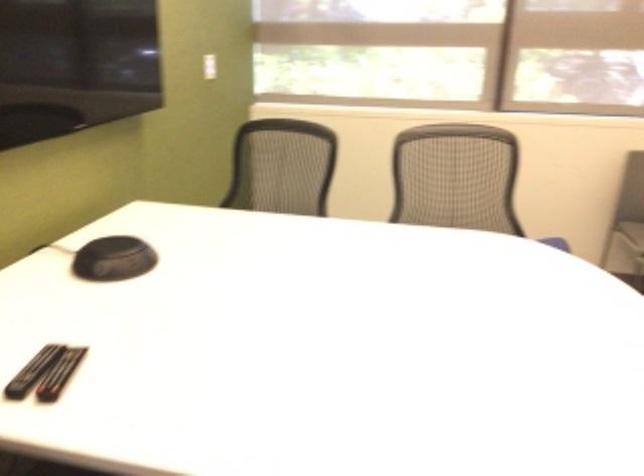
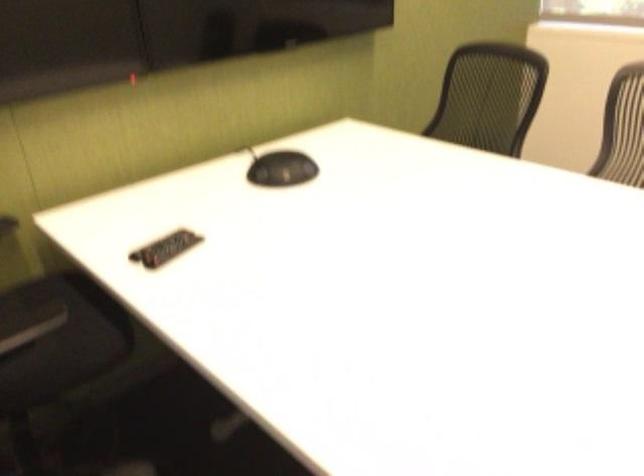
Find the pixel in the second image that matches pixel 125 258 in the first image.

(281, 169)